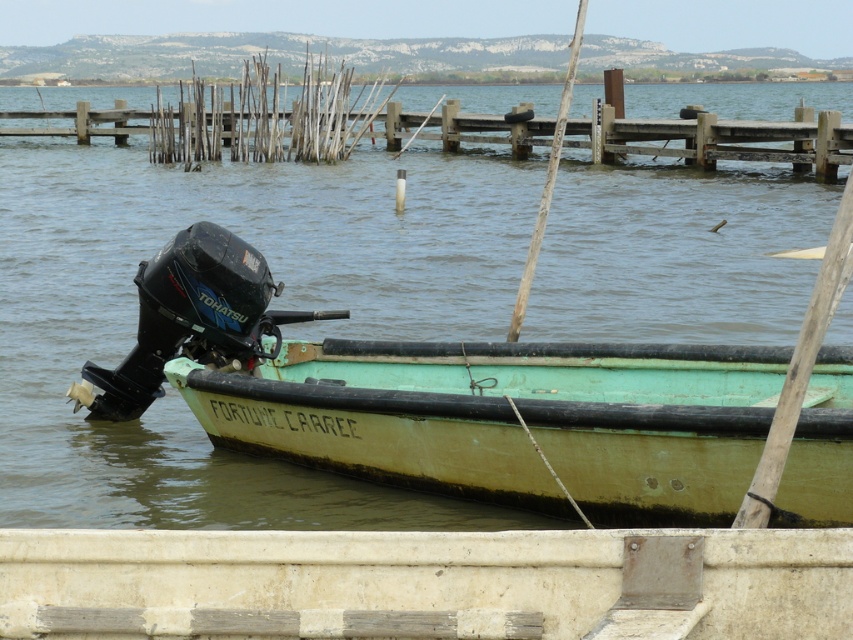
Question: Where is green matte boat at center located in relation to wooden dock at upper center in the image?

Choices:
 (A) above
 (B) below

Answer: (B)

Question: Can you confirm if green matte boat at center is bigger than wooden dock at upper center?

Choices:
 (A) no
 (B) yes

Answer: (A)

Question: Where is green matte boat at center located in relation to wooden dock at upper center in the image?

Choices:
 (A) above
 (B) below

Answer: (B)